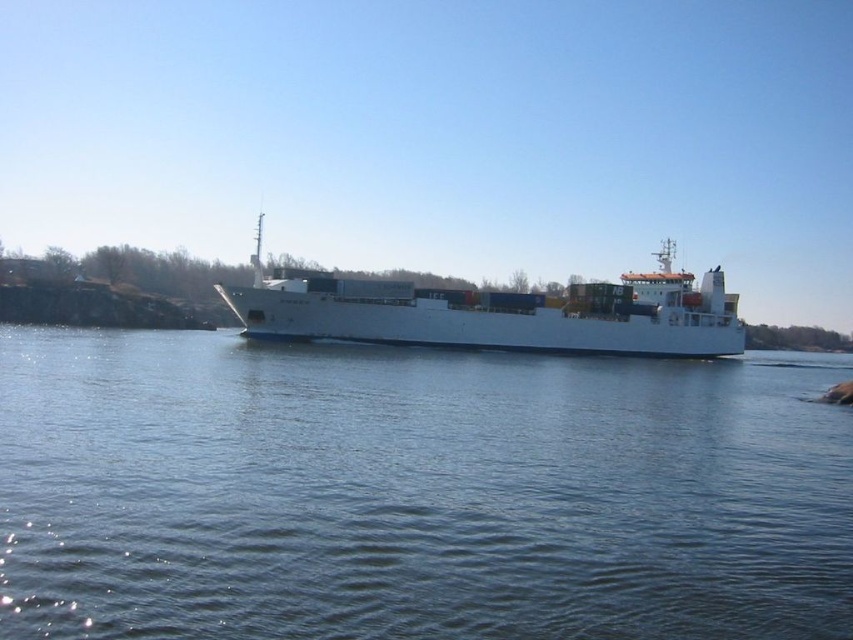
Is blue water at center thinner than white matte container ship at center?

Yes.

Is point (173, 577) farther from camera compared to point (462, 330)?

No, (173, 577) is closer to viewer.

Is point (341, 608) positioned in front of point (379, 285)?

Yes.

Locate an element on the screen. This screenshot has width=853, height=640. blue water at center is located at coordinates (415, 492).